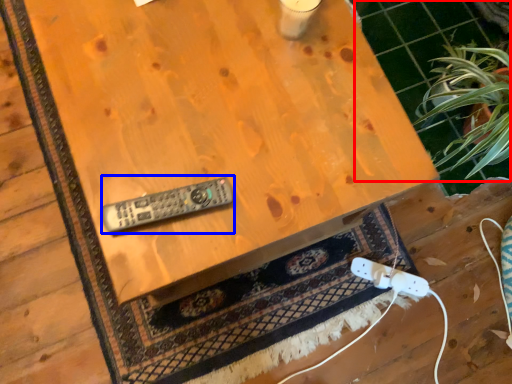
Question: Which of the following is the closest to the observer, tile (highlighted by a red box) or control (highlighted by a blue box)?

Choices:
 (A) tile
 (B) control

Answer: (B)